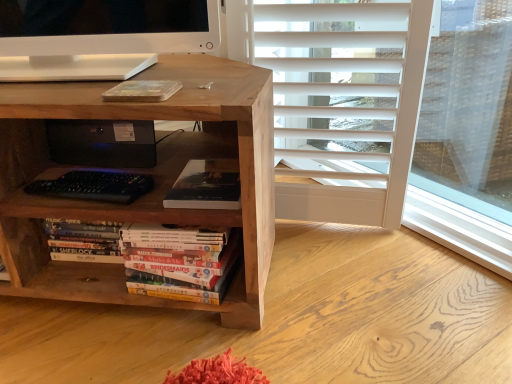
Question: From a real-world perspective, is black plastic speaker at center beneath natural wood desk at center?

Choices:
 (A) yes
 (B) no

Answer: (B)

Question: Is black plastic speaker at center wider than natural wood desk at center?

Choices:
 (A) yes
 (B) no

Answer: (B)

Question: From a real-world perspective, is black plastic speaker at center on top of natural wood desk at center?

Choices:
 (A) no
 (B) yes

Answer: (B)

Question: From the image's perspective, is black plastic speaker at center located beneath natural wood desk at center?

Choices:
 (A) yes
 (B) no

Answer: (B)

Question: Is black plastic speaker at center bigger than natural wood desk at center?

Choices:
 (A) yes
 (B) no

Answer: (B)

Question: Is black plastic speaker at center situated inside matte black book at center, positioned as the second book in bottom-to-top order, or outside?

Choices:
 (A) inside
 (B) outside

Answer: (B)

Question: Considering the relative positions of black plastic speaker at center and matte black book at center, positioned as the first book in top-to-bottom order, in the image provided, is black plastic speaker at center to the left or to the right of matte black book at center, positioned as the first book in top-to-bottom order,?

Choices:
 (A) left
 (B) right

Answer: (A)

Question: In the image, is black plastic speaker at center positioned in front of or behind matte black book at center, positioned as the first book in top-to-bottom order?

Choices:
 (A) front
 (B) behind

Answer: (B)

Question: Considering the positions of point (142, 127) and point (186, 198), is point (142, 127) closer or farther from the camera than point (186, 198)?

Choices:
 (A) farther
 (B) closer

Answer: (A)

Question: From the image's perspective, is hardcover books at center, the first book when ordered from bottom to top, positioned above or below matte black book at center, positioned as the first book in top-to-bottom order?

Choices:
 (A) above
 (B) below

Answer: (B)

Question: Relative to matte black book at center, positioned as the first book in top-to-bottom order, is hardcover books at center, which is the 2th book from top to bottom, in front or behind?

Choices:
 (A) behind
 (B) front

Answer: (B)

Question: In terms of width, does hardcover books at center, the first book when ordered from bottom to top, look wider or thinner when compared to matte black book at center, positioned as the first book in top-to-bottom order?

Choices:
 (A) thin
 (B) wide

Answer: (A)

Question: Which is correct: hardcover books at center, the first book when ordered from bottom to top, is inside matte black book at center, positioned as the second book in bottom-to-top order, or outside of it?

Choices:
 (A) inside
 (B) outside

Answer: (B)

Question: Relative to natural wood desk at center, is black plastic speaker at center in front or behind?

Choices:
 (A) front
 (B) behind

Answer: (B)

Question: Considering the positions of black plastic speaker at center and natural wood desk at center in the image, is black plastic speaker at center bigger or smaller than natural wood desk at center?

Choices:
 (A) small
 (B) big

Answer: (A)